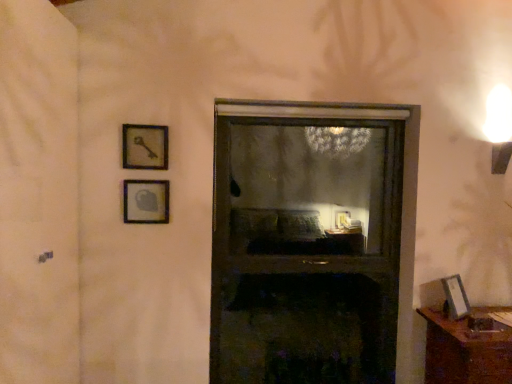
Question: Considering the positions of point (210, 352) and point (153, 167), is point (210, 352) closer or farther from the camera than point (153, 167)?

Choices:
 (A) farther
 (B) closer

Answer: (A)

Question: From the image's perspective, relative to wooden key at upper left, marked as the second picture frame in a left-to-right arrangement, is transparent glass window at center above or below?

Choices:
 (A) below
 (B) above

Answer: (A)

Question: Estimate the real-world distances between objects in this image. Which object is closer to the matte glass picture frame at upper left, which is counted as the 1th picture frame, starting from the left?

Choices:
 (A) matte silver picture frame at lower right, acting as the first picture frame starting from the bottom
 (B) brown wooden table at lower right
 (C) transparent plastic screen door at left
 (D) transparent glass window at center
 (E) wooden key at upper left, marked as the second picture frame in a left-to-right arrangement

Answer: (E)

Question: Which object is the farthest from the transparent glass window at center?

Choices:
 (A) wooden key at upper left, marked as the second picture frame in a right-to-left arrangement
 (B) matte glass picture frame at upper left, the second picture frame from the top
 (C) brown wooden table at lower right
 (D) transparent plastic screen door at left
 (E) matte silver picture frame at lower right, acting as the first picture frame starting from the bottom

Answer: (D)